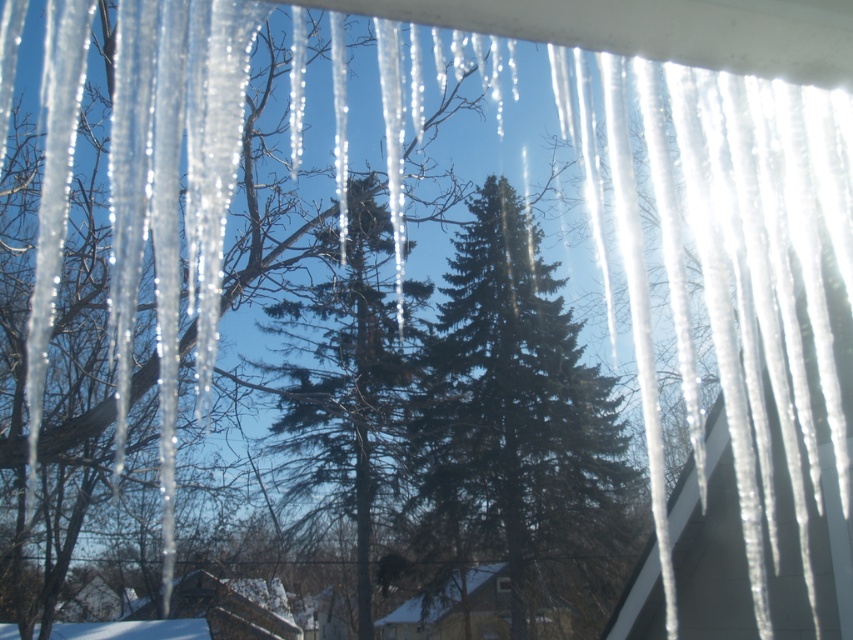
Question: Which point is closer to the camera?

Choices:
 (A) transparent glass window at center
 (B) green matte evergreen tree at center

Answer: (A)

Question: Considering the real-world distances, which object is closest to the green matte evergreen tree at center?

Choices:
 (A) transparent glass window at center
 (B) green textured pine tree at center

Answer: (A)

Question: Does green matte evergreen tree at center appear under transparent glass window at center?

Choices:
 (A) no
 (B) yes

Answer: (A)

Question: Which of these objects is positioned closest to the transparent glass window at center?

Choices:
 (A) green textured pine tree at center
 (B) green matte evergreen tree at center

Answer: (B)

Question: Does green textured pine tree at center come in front of transparent glass window at center?

Choices:
 (A) yes
 (B) no

Answer: (A)

Question: From the image, what is the correct spatial relationship of green matte evergreen tree at center in relation to transparent glass window at center?

Choices:
 (A) below
 (B) above

Answer: (B)